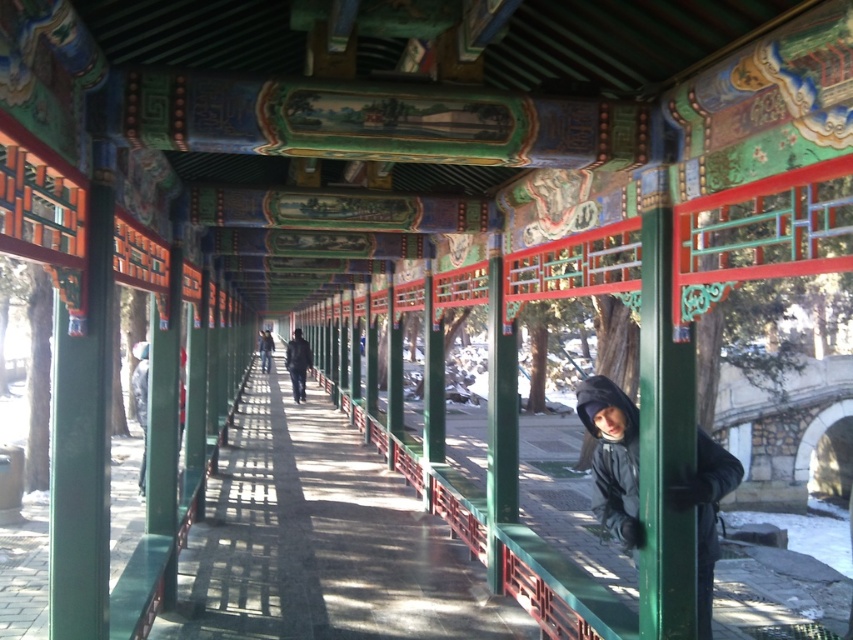
You are standing in the traditional Chinese corridor and see two jackets hanging from the green pillars. The jackets are the black matte jacket at center and the dark blue jacket at center. Which jacket is closer to you?

The black matte jacket at center is closer to you because it is in front of the dark blue jacket at center.

You are standing at the entrance of the traditional Chinese architectural corridor. You see a black matte jacket at center. Where is the black matte jacket located in relation to the entrance?

The black matte jacket at center is located at point (612, 456) in the corridor, which is approximately 71.4 cm from the left edge and 71.9 cm from the bottom edge of the image. Since the entrance is at the starting point, the jacket is positioned towards the center of the corridor, further away from the entrance.